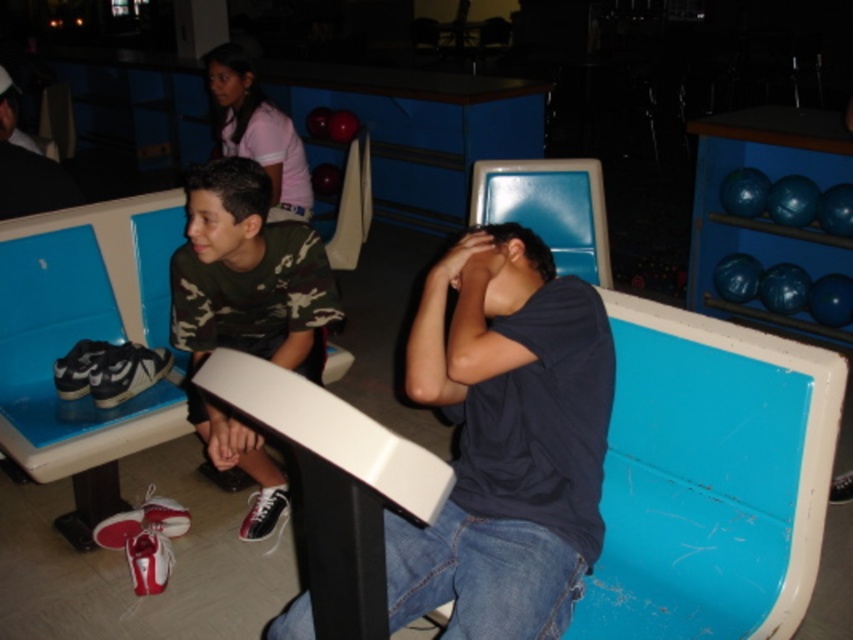
You are a photographer standing 2 meters away from the bench. You want to take a photo that includes both the camo fabric shirt at center and the matte black shirt at center. Given the distance between them, will you need to zoom in or zoom out to ensure both are fully visible in the frame?

The distance between the camo fabric shirt at center and the matte black shirt at center is 1.26 meters. Since you are standing 2 meters away from the bench, you will need to zoom out to ensure both subjects are fully visible in the frame.